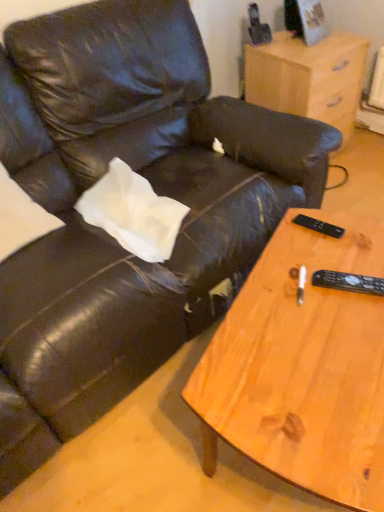
This screenshot has width=384, height=512. What do you see at coordinates (348, 282) in the screenshot? I see `black plastic remote at right, acting as the 2th remote starting from the back` at bounding box center [348, 282].

In order to click on black plastic remote at right, the first remote from the front in this screenshot , I will do tap(348, 282).

Consider the image. Measure the distance between point (341, 346) and camera.

The depth of point (341, 346) is 37.05 inches.

The image size is (384, 512). What are the coordinates of `black plastic remote at right, arranged as the 2th remote when viewed from the top` in the screenshot? It's located at (348, 282).

From the image's perspective, is light wood/finely finished nightstand at upper right on black plastic remote at right, which ranks as the 1th remote in top-to-bottom order?

Yes, from the image's perspective, light wood/finely finished nightstand at upper right is on top of black plastic remote at right, which ranks as the 1th remote in top-to-bottom order.

You are a GUI agent. You are given a task and a screenshot of the screen. Output one action in this format:
    pyautogui.click(x=<x>, y=<y>)
    Task: Click on the nightstand behind the black plastic remote at right, the second remote positioned from the bottom
    This screenshot has width=384, height=512.
    Given the screenshot: What is the action you would take?
    pyautogui.click(x=308, y=77)

Can you see light wood/finely finished nightstand at upper right touching black plastic remote at right, the first remote viewed from the back?

No, light wood/finely finished nightstand at upper right is not touching black plastic remote at right, the first remote viewed from the back.

Considering the relative positions of light wood/finely finished nightstand at upper right and black plastic remote at right, which ranks as the 1th remote in top-to-bottom order, in the image provided, is light wood/finely finished nightstand at upper right in front of black plastic remote at right, which ranks as the 1th remote in top-to-bottom order,?

That is False.

Considering the sizes of wooden coffee table at lower right and light wood/finely finished nightstand at upper right in the image, is wooden coffee table at lower right bigger or smaller than light wood/finely finished nightstand at upper right?

In the image, wooden coffee table at lower right appears to be larger than light wood/finely finished nightstand at upper right.

Choose the correct answer: Is wooden coffee table at lower right inside light wood/finely finished nightstand at upper right or outside it?

wooden coffee table at lower right is located beyond the bounds of light wood/finely finished nightstand at upper right.

Does wooden coffee table at lower right lie behind light wood/finely finished nightstand at upper right?

No, wooden coffee table at lower right is in front of light wood/finely finished nightstand at upper right.

How many degrees apart are the facing directions of wooden coffee table at lower right and light wood/finely finished nightstand at upper right?

They differ by 158 degrees in their facing directions.

Which of these two, light wood/finely finished nightstand at upper right or wooden coffee table at lower right, is thinner?

Thinner between the two is light wood/finely finished nightstand at upper right.

Which point is more forward, (322, 94) or (245, 389)?

Point (245, 389)

Is light wood/finely finished nightstand at upper right far away from wooden coffee table at lower right?

light wood/finely finished nightstand at upper right is far away from wooden coffee table at lower right.

Which object is closer to the camera, light wood/finely finished nightstand at upper right or wooden coffee table at lower right?

wooden coffee table at lower right is in front.

Which object is further away from the camera taking this photo, black plastic remote at right, which ranks as the 1th remote in top-to-bottom order, or light wood/finely finished nightstand at upper right?

light wood/finely finished nightstand at upper right.

Consider the image. Considering the relative sizes of black plastic remote at right, the second remote positioned from the bottom, and light wood/finely finished nightstand at upper right in the image provided, is black plastic remote at right, the second remote positioned from the bottom, smaller than light wood/finely finished nightstand at upper right?

Yes, black plastic remote at right, the second remote positioned from the bottom, is smaller than light wood/finely finished nightstand at upper right.

Is black plastic remote at right, the first remote viewed from the back, taller than light wood/finely finished nightstand at upper right?

No.

At what (x,y) coordinates should I click in order to perform the action: click on nightstand below the black plastic remote at right, acting as the 2th remote starting from the back (from a real-world perspective). Please return your answer as a coordinate pair (x, y). The height and width of the screenshot is (512, 384). Looking at the image, I should click on (308, 77).

Is the position of black plastic remote at right, acting as the 2th remote starting from the back, more distant than that of light wood/finely finished nightstand at upper right?

No, black plastic remote at right, acting as the 2th remote starting from the back, is in front of light wood/finely finished nightstand at upper right.

Is black plastic remote at right, the first remote from the front, turned away from light wood/finely finished nightstand at upper right?

black plastic remote at right, the first remote from the front, does not have its back to light wood/finely finished nightstand at upper right.

Considering the sizes of black plastic remote at right, the first remote from the bottom, and light wood/finely finished nightstand at upper right in the image, is black plastic remote at right, the first remote from the bottom, wider or thinner than light wood/finely finished nightstand at upper right?

In the image, black plastic remote at right, the first remote from the bottom, appears to be more narrow than light wood/finely finished nightstand at upper right.

Is black plastic remote at right, acting as the 2th remote starting from the back, not inside black plastic remote at right, the second remote positioned from the bottom?

black plastic remote at right, acting as the 2th remote starting from the back, lies outside black plastic remote at right, the second remote positioned from the bottom,'s area.

In terms of size, does black plastic remote at right, the first remote from the bottom, appear bigger or smaller than black plastic remote at right, the second remote from the front?

Clearly, black plastic remote at right, the first remote from the bottom, is larger in size than black plastic remote at right, the second remote from the front.

Is black plastic remote at right, the first remote from the bottom, at the right side of black plastic remote at right, the first remote viewed from the back?

Indeed, black plastic remote at right, the first remote from the bottom, is positioned on the right side of black plastic remote at right, the first remote viewed from the back.

From the image's perspective, between black plastic remote at right, the first remote from the bottom, and black plastic remote at right, the second remote positioned from the bottom, who is located below?

black plastic remote at right, the first remote from the bottom, is shown below in the image.

From a real-world perspective, relative to wooden coffee table at lower right, is black plastic remote at right, acting as the 2th remote starting from the back, vertically above or below?

From a real-world perspective, black plastic remote at right, acting as the 2th remote starting from the back, is physically above wooden coffee table at lower right.

Which of these two, black plastic remote at right, the first remote from the bottom, or wooden coffee table at lower right, is bigger?

wooden coffee table at lower right.

Is black plastic remote at right, arranged as the 2th remote when viewed from the top, next to wooden coffee table at lower right?

No, black plastic remote at right, arranged as the 2th remote when viewed from the top, is not with wooden coffee table at lower right.

How many degrees apart are the facing directions of black plastic remote at right, arranged as the 2th remote when viewed from the top, and wooden coffee table at lower right?

They differ by 14.6 degrees in their facing directions.

Find the location of a particular element. The image size is (384, 512). nightstand above the black plastic remote at right, the second remote from the front (from the image's perspective) is located at coordinates (x=308, y=77).

You are a GUI agent. You are given a task and a screenshot of the screen. Output one action in this format:
    pyautogui.click(x=<x>, y=<y>)
    Task: Click on the coffee table on the left of light wood/finely finished nightstand at upper right
    This screenshot has height=512, width=384.
    Given the screenshot: What is the action you would take?
    pyautogui.click(x=308, y=369)

Considering their positions, is light wood/finely finished nightstand at upper right positioned further to wooden coffee table at lower right than black plastic remote at right, the first remote from the bottom?

Based on the image, light wood/finely finished nightstand at upper right appears to be further to wooden coffee table at lower right.

Looking at the image, which one is located further to black plastic remote at right, arranged as the 2th remote when viewed from the top, black plastic remote at right, the first remote viewed from the back, or wooden coffee table at lower right?

wooden coffee table at lower right is positioned further to the anchor black plastic remote at right, arranged as the 2th remote when viewed from the top.

From the image, which object appears to be farther from black plastic remote at right, arranged as the 2th remote when viewed from the top, black plastic remote at right, the second remote positioned from the bottom, or light wood/finely finished nightstand at upper right?

Among the two, light wood/finely finished nightstand at upper right is located further to black plastic remote at right, arranged as the 2th remote when viewed from the top.

Which object lies nearer to the anchor point black plastic remote at right, arranged as the 2th remote when viewed from the top, wooden coffee table at lower right or light wood/finely finished nightstand at upper right?

wooden coffee table at lower right is closer to black plastic remote at right, arranged as the 2th remote when viewed from the top.

In the scene shown: When comparing their distances from wooden coffee table at lower right, does black plastic remote at right, the first remote from the bottom, or black plastic remote at right, which ranks as the 1th remote in top-to-bottom order, seem further?

The object further to wooden coffee table at lower right is black plastic remote at right, which ranks as the 1th remote in top-to-bottom order.

Consider the image. From the image, which object appears to be farther from black plastic remote at right, which ranks as the 1th remote in top-to-bottom order, black plastic remote at right, arranged as the 2th remote when viewed from the top, or wooden coffee table at lower right?

wooden coffee table at lower right lies further to black plastic remote at right, which ranks as the 1th remote in top-to-bottom order, than the other object.

Which object lies further to the anchor point wooden coffee table at lower right, light wood/finely finished nightstand at upper right or black plastic remote at right, the second remote positioned from the bottom?

Among the two, light wood/finely finished nightstand at upper right is located further to wooden coffee table at lower right.

From the image, which object appears to be nearer to wooden coffee table at lower right, black plastic remote at right, the first remote from the bottom, or light wood/finely finished nightstand at upper right?

The object closer to wooden coffee table at lower right is black plastic remote at right, the first remote from the bottom.

You are a GUI agent. You are given a task and a screenshot of the screen. Output one action in this format:
    pyautogui.click(x=<x>, y=<y>)
    Task: Click on the remote between wooden coffee table at lower right and black plastic remote at right, the second remote positioned from the bottom, in the front-back direction
    Image resolution: width=384 pixels, height=512 pixels.
    Given the screenshot: What is the action you would take?
    pyautogui.click(x=348, y=282)

Where is `remote between light wood/finely finished nightstand at upper right and black plastic remote at right, the first remote from the front, vertically`? The width and height of the screenshot is (384, 512). remote between light wood/finely finished nightstand at upper right and black plastic remote at right, the first remote from the front, vertically is located at coordinates (319, 226).